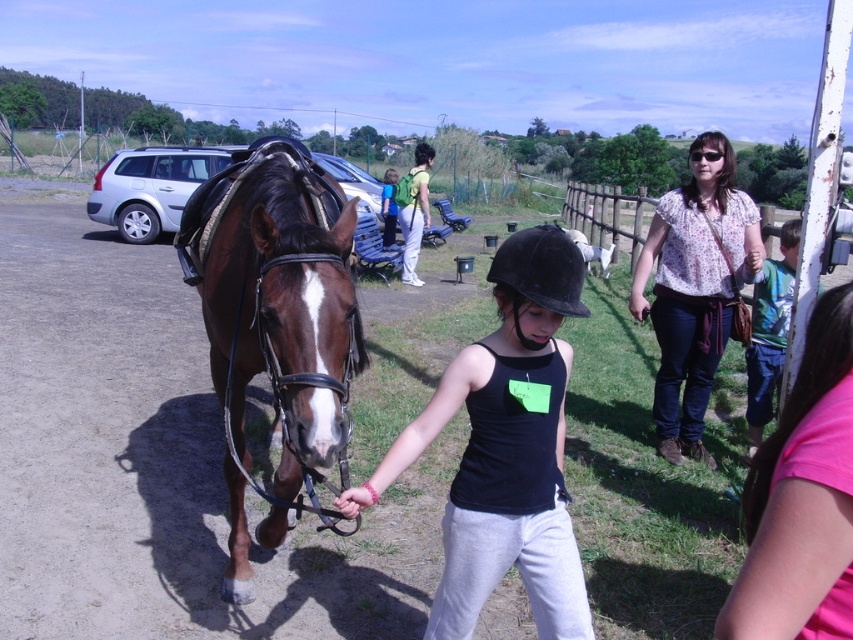
From the picture: You are a photographer standing at the edge of the scene. You need to capture a photo that includes both the black matte helmet at center and the floral blouse at center. Based on their positions, can you fit both subjects into the frame without moving your camera? Explain your reasoning.

The black matte helmet at center is 2.75 meters from the floral blouse at center. Since the distance between them is 2.75 meters, and assuming a typical camera lens can capture a field of view that accommodates this distance at the photographer s current position, it should be possible to include both in the frame without moving the camera.